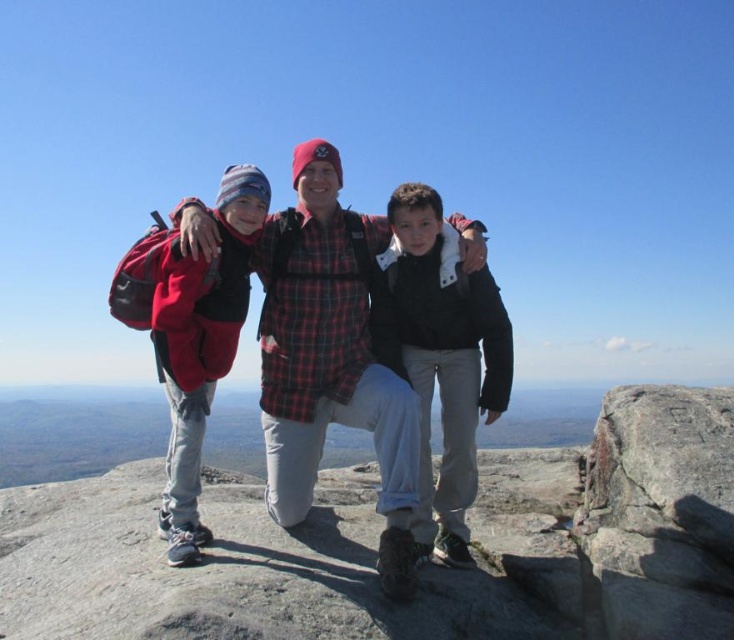
Is plaid flannel shirt at center thinner than black matte jacket at center?

Incorrect, plaid flannel shirt at center's width is not less than black matte jacket at center's.

What do you see at coordinates (330, 356) in the screenshot? I see `plaid flannel shirt at center` at bounding box center [330, 356].

Between point (319, 326) and point (479, 356), which one is positioned behind?

Positioned behind is point (479, 356).

Image resolution: width=734 pixels, height=640 pixels. In order to click on plaid flannel shirt at center in this screenshot , I will do `click(330, 356)`.

Image resolution: width=734 pixels, height=640 pixels. Identify the location of gray granite rock at center. (374, 544).

Between point (666, 632) and point (461, 547), which one is positioned behind?

The point (461, 547) is behind.

At what (x,y) coordinates should I click in order to perform the action: click on gray granite rock at center. Please return your answer as a coordinate pair (x, y). Looking at the image, I should click on [374, 544].

Between plaid flannel shirt at center and red fleece jacket at left, which one is positioned lower?

plaid flannel shirt at center is lower down.

Which is more to the left, plaid flannel shirt at center or red fleece jacket at left?

red fleece jacket at left

Does point (337, 296) come farther from viewer compared to point (200, 276)?

Yes, it is behind point (200, 276).

Locate an element on the screen. This screenshot has height=640, width=734. plaid flannel shirt at center is located at coordinates (330, 356).